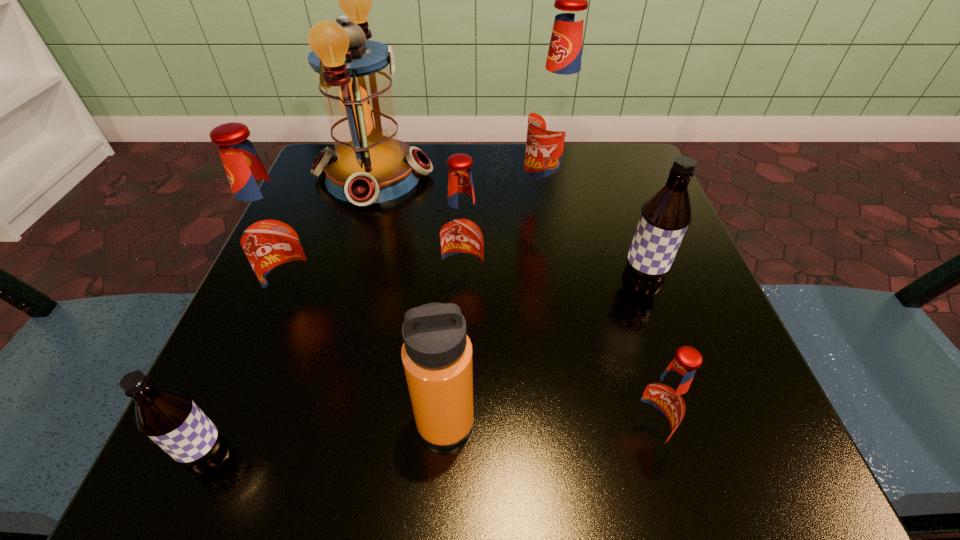
Find the location of a particular element. the farthest red root beer is located at coordinates (556, 120).

This screenshot has width=960, height=540. Find the location of `the biggest red root beer`. the biggest red root beer is located at coordinates (556, 120).

I want to click on lantern, so click(x=369, y=164).

This screenshot has width=960, height=540. Identify the location of the third smallest red root beer. (273, 237).

Find the location of a particular element. The height and width of the screenshot is (540, 960). the second tallest root beer is located at coordinates (273, 237).

Where is `the right brown root beer`? The width and height of the screenshot is (960, 540). the right brown root beer is located at coordinates pos(665,216).

Image resolution: width=960 pixels, height=540 pixels. I want to click on the bigger brown root beer, so click(x=665, y=216).

At what (x,y) coordinates should I click in order to perform the action: click on the third biggest red root beer. Please return your answer as a coordinate pair (x, y). Image resolution: width=960 pixels, height=540 pixels. Looking at the image, I should click on (462, 235).

What are the coordinates of `the fourth root beer from right to left` in the screenshot? It's located at (462, 235).

What are the coordinates of `thermos bottle` in the screenshot? It's located at (437, 354).